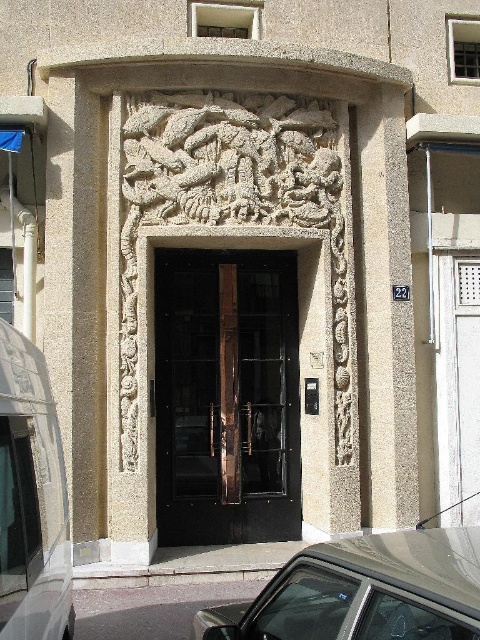
Question: Considering the relative positions of metallic silver car at lower center and white matte van at left in the image provided, where is metallic silver car at lower center located with respect to white matte van at left?

Choices:
 (A) above
 (B) below

Answer: (B)

Question: In this image, where is polished bronze door at center located relative to white matte van at left?

Choices:
 (A) right
 (B) left

Answer: (A)

Question: Among these points, which one is farthest from the camera?

Choices:
 (A) (371, 592)
 (B) (29, 528)
 (C) (277, 305)

Answer: (C)

Question: Among these objects, which one is farthest from the camera?

Choices:
 (A) metallic silver car at lower center
 (B) polished bronze door at center
 (C) white matte van at left

Answer: (B)

Question: Which object appears closest to the camera in this image?

Choices:
 (A) metallic silver car at lower center
 (B) white matte van at left
 (C) polished bronze door at center

Answer: (A)

Question: Is polished bronze door at center in front of white matte van at left?

Choices:
 (A) no
 (B) yes

Answer: (A)